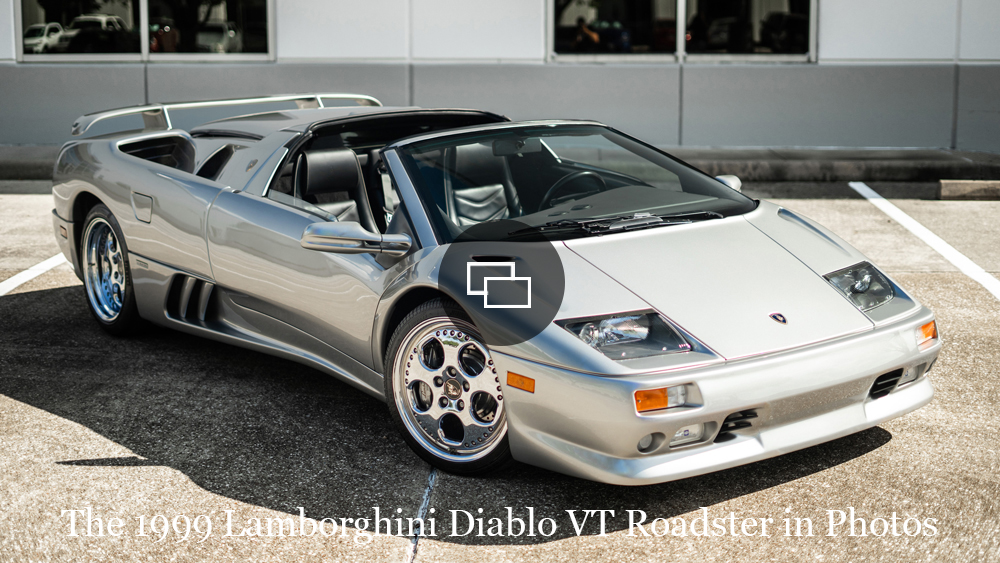
This screenshot has height=563, width=1000. Identify the location of light. (908, 372).